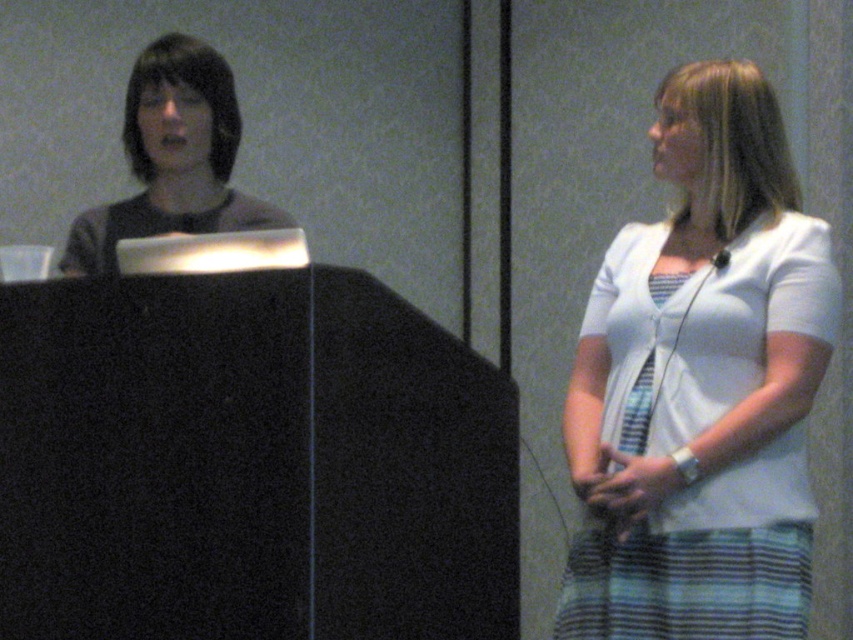
Is white textured blouse at center below matte black shirt at left?

Yes.

The height and width of the screenshot is (640, 853). What are the coordinates of `white textured blouse at center` in the screenshot? It's located at (701, 385).